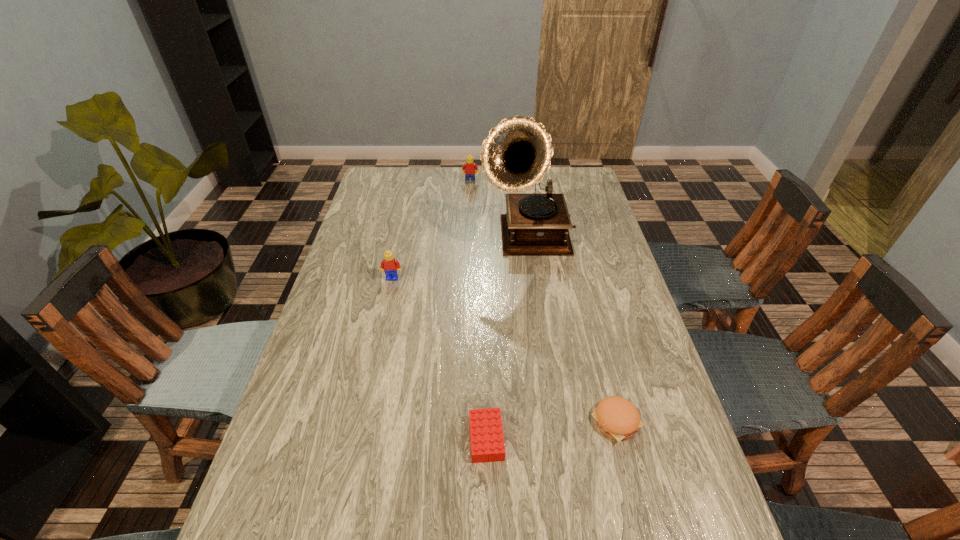
This screenshot has height=540, width=960. I want to click on free point located on the left of the patty, so click(x=525, y=422).

At what (x,y) coordinates should I click in order to perform the action: click on vacant position located on the back of the shortest Lego. Please return your answer as a coordinate pair (x, y). The width and height of the screenshot is (960, 540). Looking at the image, I should click on (485, 315).

This screenshot has height=540, width=960. In order to click on object that is at the far edge in this screenshot , I will do `click(470, 167)`.

Locate an element on the screen. The height and width of the screenshot is (540, 960). object at the left edge is located at coordinates (389, 265).

You are a GUI agent. You are given a task and a screenshot of the screen. Output one action in this format:
    pyautogui.click(x=<x>, y=<y>)
    Task: Click on the record player that is positioned at the right edge
    
    Given the screenshot: What is the action you would take?
    pyautogui.click(x=516, y=154)

At what (x,y) coordinates should I click in order to perform the action: click on patty present at the right edge. Please return your answer as a coordinate pair (x, y). This screenshot has height=540, width=960. Looking at the image, I should click on (616, 417).

The height and width of the screenshot is (540, 960). In order to click on vacant space at the far edge in this screenshot , I will do `click(486, 186)`.

This screenshot has height=540, width=960. What are the coordinates of `vacant area at the left edge` in the screenshot? It's located at (x=344, y=296).

Identify the location of vacant area at the right edge of the desktop. The height and width of the screenshot is (540, 960). (609, 255).

The image size is (960, 540). Find the location of `free space at the far left corner`. free space at the far left corner is located at coordinates click(x=412, y=169).